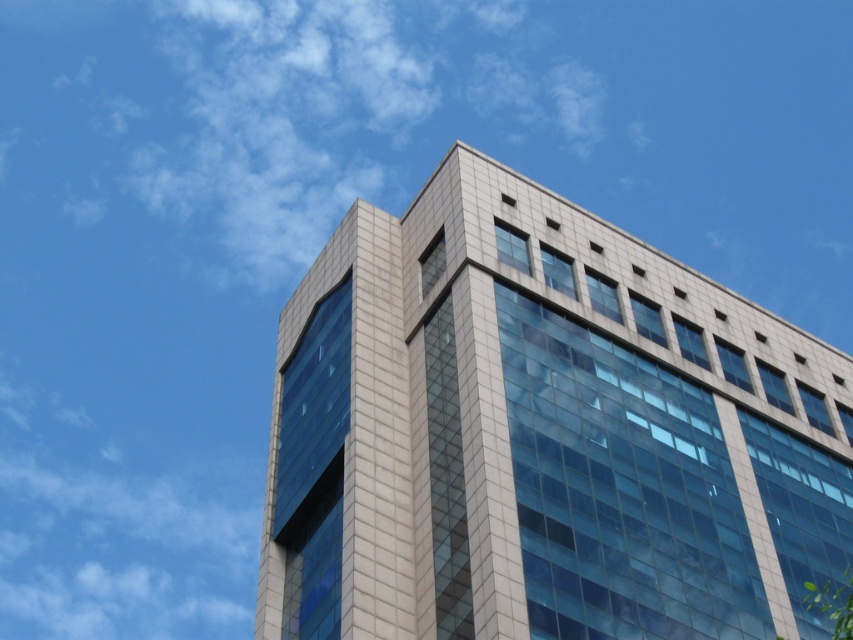
Question: Does gray tile building at center appear on the left side of green leafy tree at lower right?

Choices:
 (A) no
 (B) yes

Answer: (B)

Question: Can you confirm if gray tile building at center is bigger than green leafy tree at lower right?

Choices:
 (A) no
 (B) yes

Answer: (B)

Question: Which point is farther to the camera?

Choices:
 (A) (677, 484)
 (B) (834, 621)

Answer: (B)

Question: Can you confirm if gray tile building at center is positioned to the left of green leafy tree at lower right?

Choices:
 (A) no
 (B) yes

Answer: (B)

Question: Which of the following is the farthest from the observer?

Choices:
 (A) (821, 595)
 (B) (294, 474)

Answer: (B)